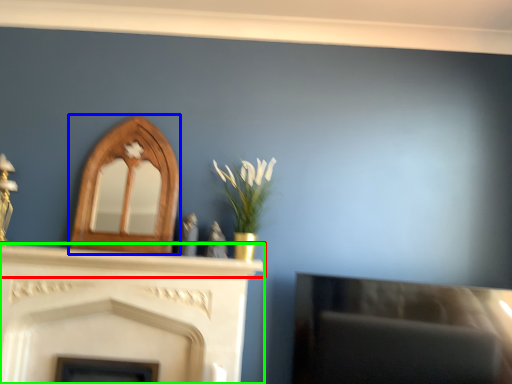
Question: Considering the real-world distances, which object is closest to mantle (highlighted by a red box)? fireplace (highlighted by a blue box) or fireplace (highlighted by a green box).

Choices:
 (A) fireplace
 (B) fireplace

Answer: (B)